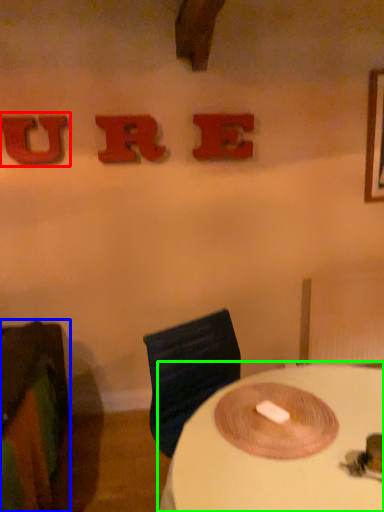
Question: Which object is positioned farthest from alphabet (highlighted by a red box)? Select from furniture (highlighted by a blue box) and table (highlighted by a green box).

Choices:
 (A) furniture
 (B) table

Answer: (B)